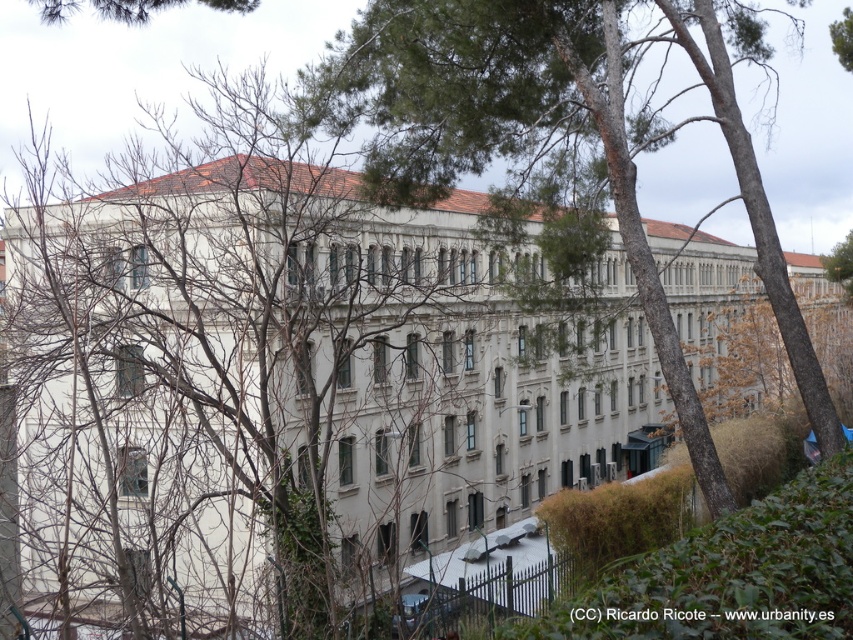
Question: Considering the relative positions of green leafy tree at center and green leafy tree at upper right in the image provided, where is green leafy tree at center located with respect to green leafy tree at upper right?

Choices:
 (A) left
 (B) right

Answer: (A)

Question: Does green leafy tree at upper left have a greater width compared to green leafy tree at upper right?

Choices:
 (A) no
 (B) yes

Answer: (B)

Question: Which object is farther from the camera taking this photo?

Choices:
 (A) green leafy tree at center
 (B) bare branches at center
 (C) green leafy tree at upper right
 (D) green leafy tree at upper left

Answer: (C)

Question: Which point is farther to the camera?

Choices:
 (A) (76, 604)
 (B) (54, 17)
 (C) (849, 70)
 (D) (364, 108)

Answer: (C)

Question: Which of these objects is positioned farthest from the green leafy tree at upper right?

Choices:
 (A) green leafy tree at center
 (B) green leafy tree at upper left

Answer: (B)

Question: Can you confirm if bare branches at center is positioned below green leafy tree at upper left?

Choices:
 (A) yes
 (B) no

Answer: (A)